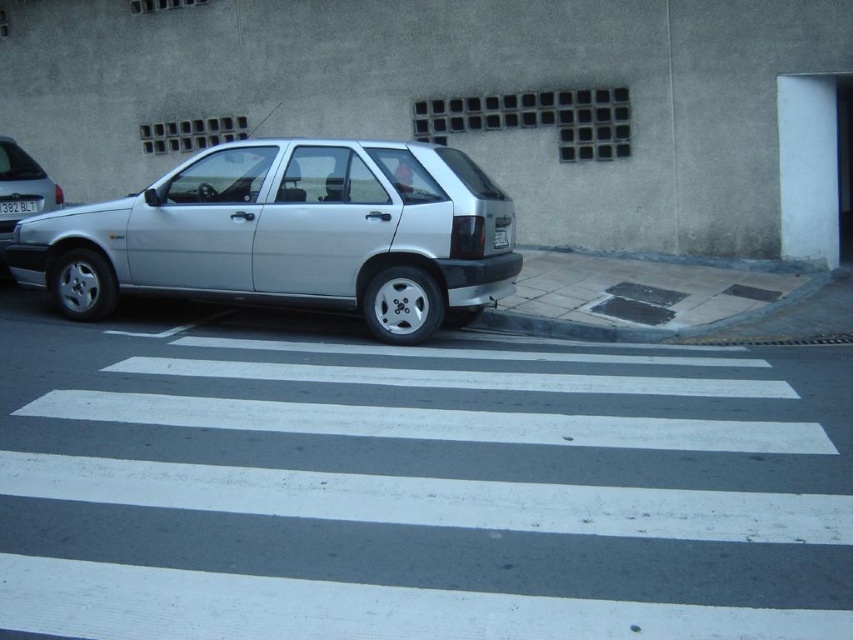
Question: Does satin silver car at center have a smaller size compared to white plastic license plate at center?

Choices:
 (A) no
 (B) yes

Answer: (A)

Question: Which object is farther from the camera taking this photo?

Choices:
 (A) satin silver car at center
 (B) silver metallic hatchback at left

Answer: (B)

Question: Which point is farther to the camera?

Choices:
 (A) (173, 243)
 (B) (26, 204)
 (C) (4, 188)

Answer: (B)

Question: From the image, what is the correct spatial relationship of silver metallic hatchback at left in relation to white plastic license plate at center?

Choices:
 (A) above
 (B) below

Answer: (A)

Question: Does satin silver car at center have a larger size compared to white plastic license plate at center?

Choices:
 (A) yes
 (B) no

Answer: (A)

Question: Which point appears farthest from the camera in this image?

Choices:
 (A) (0, 193)
 (B) (22, 212)

Answer: (B)